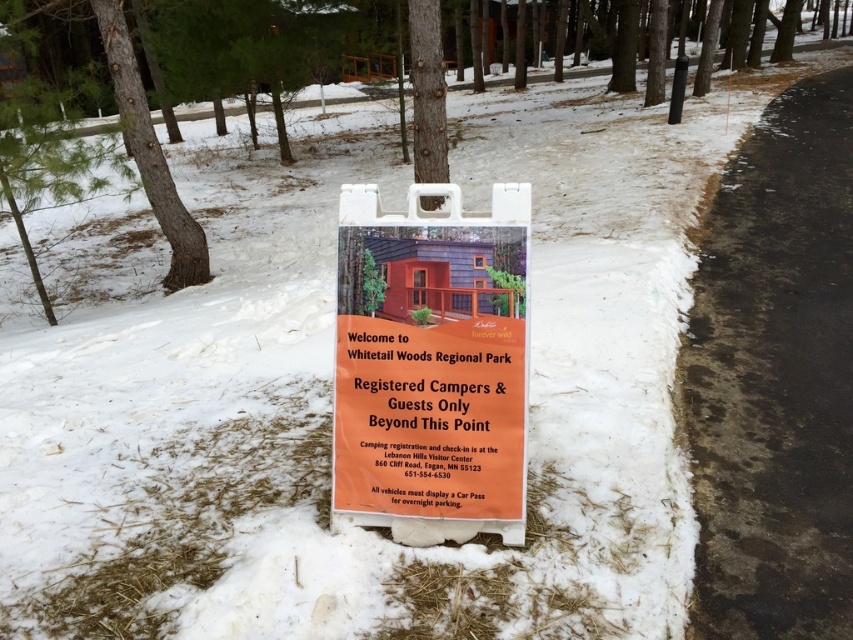
Question: Is orange paper sign at center to the right of smooth brown tree trunk at center from the viewer's perspective?

Choices:
 (A) yes
 (B) no

Answer: (A)

Question: Which point is closer to the camera?

Choices:
 (A) orange paper sign at center
 (B) smooth brown bark at left
 (C) smooth brown tree trunk at center

Answer: (A)

Question: Which object appears farthest from the camera in this image?

Choices:
 (A) smooth brown tree trunk at center
 (B) smooth brown bark at left

Answer: (B)

Question: Among these objects, which one is farthest from the camera?

Choices:
 (A) orange paper sign at center
 (B) smooth brown tree trunk at center

Answer: (B)

Question: Does smooth brown bark at left have a lesser width compared to smooth brown tree trunk at center?

Choices:
 (A) no
 (B) yes

Answer: (A)

Question: Can you confirm if orange paper sign at center is bigger than smooth brown tree trunk at center?

Choices:
 (A) yes
 (B) no

Answer: (B)